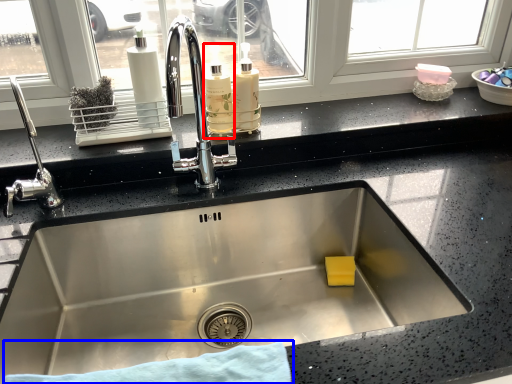
Question: Which object is further to the camera taking this photo, bottle (highlighted by a red box) or bath towel (highlighted by a blue box)?

Choices:
 (A) bottle
 (B) bath towel

Answer: (A)